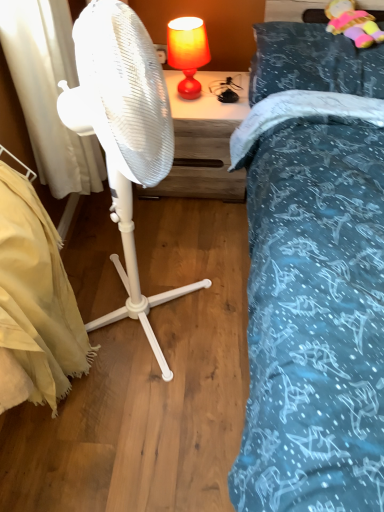
Where is `free space to the back side of white plastic fan at center`? The image size is (384, 512). free space to the back side of white plastic fan at center is located at coordinates (159, 231).